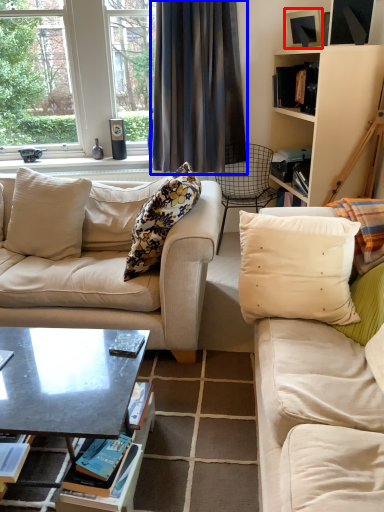
Question: Among these objects, which one is farthest to the camera, picture frame (highlighted by a red box) or curtain (highlighted by a blue box)?

Choices:
 (A) picture frame
 (B) curtain

Answer: (B)